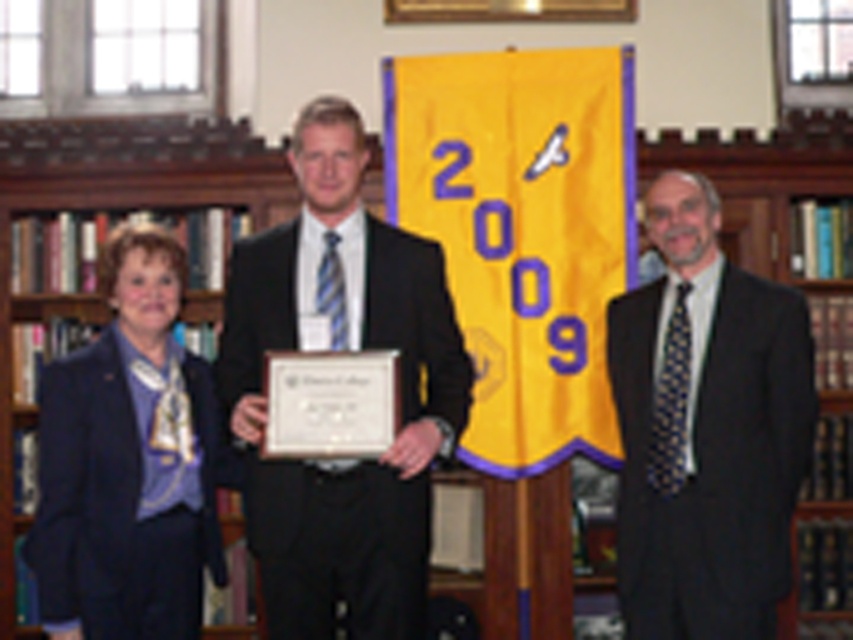
Does matte black suit at center have a lesser width compared to matte black blazer at left?

No.

Who is more distant from viewer, (355,316) or (55,538)?

Point (355,316)

This screenshot has height=640, width=853. I want to click on matte black suit at center, so click(341, 348).

Where is `matte black suit at center`? Image resolution: width=853 pixels, height=640 pixels. matte black suit at center is located at coordinates (341, 348).

Is point (426, 268) closer to camera compared to point (688, 579)?

Yes.

Can you confirm if matte black suit at center is bigger than dark gray suit at right?

Yes.

Find the location of a particular element. The height and width of the screenshot is (640, 853). matte black suit at center is located at coordinates (341, 348).

Is dark gray suit at right shorter than matte black blazer at left?

No.

Does dark gray suit at right have a greater width compared to matte black blazer at left?

Correct, the width of dark gray suit at right exceeds that of matte black blazer at left.

Does point (758, 580) come behind point (178, 584)?

Yes, point (758, 580) is behind point (178, 584).

Identify the location of dark gray suit at right. (706, 429).